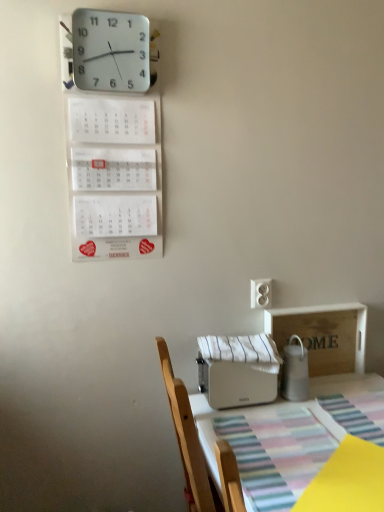
What do you see at coordinates (108, 51) in the screenshot? I see `white plastic wall clock at upper left` at bounding box center [108, 51].

I want to click on white glossy milk jug at right, acting as the 1th appliance starting from the right, so click(295, 371).

The width and height of the screenshot is (384, 512). What do you see at coordinates (290, 437) in the screenshot?
I see `white plastic toaster at lower center` at bounding box center [290, 437].

What is the approximate height of white paper calendar at upper left?

white paper calendar at upper left is 55.90 centimeters tall.

Locate an element on the screen. This screenshot has height=512, width=384. white plastic wall clock at upper left is located at coordinates (108, 51).

Which is more to the left, white plastic electric outlet at center-right or white plastic toaster at lower center?

white plastic electric outlet at center-right.

From a real-world perspective, which is physically above, white plastic electric outlet at center-right or white plastic toaster at lower center?

white plastic electric outlet at center-right, from a real-world perspective.

Are white plastic electric outlet at center-right and white plastic toaster at lower center making contact?

They are not placed beside each other.

In terms of size, does white plastic electric outlet at center-right appear bigger or smaller than white plastic toaster at lower center?

white plastic electric outlet at center-right is smaller than white plastic toaster at lower center.

From the image's perspective, which one is positioned higher, white plastic wall clock at upper left or white plastic toaster at lower center?

white plastic wall clock at upper left.

Does white plastic wall clock at upper left have a lesser width compared to white plastic toaster at lower center?

Correct, the width of white plastic wall clock at upper left is less than that of white plastic toaster at lower center.

Is white plastic wall clock at upper left spatially inside white plastic toaster at lower center, or outside of it?

white plastic wall clock at upper left cannot be found inside white plastic toaster at lower center.

Based on the photo, from a real-world perspective, does white plastic wall clock at upper left sit lower than white plastic toaster at lower center?

No, from a real-world perspective, white plastic wall clock at upper left is not beneath white plastic toaster at lower center.

From a real-world perspective, which object rests below the other?

white plastic toaster at lower center, the second appliance from the right, from a real-world perspective.

Is white plastic toaster at lower center, positioned as the first appliance in left-to-right order, not near white plastic electric outlet at center-right?

No, there isn't a large distance between white plastic toaster at lower center, positioned as the first appliance in left-to-right order, and white plastic electric outlet at center-right.

Can you confirm if white plastic wall clock at upper left is positioned to the right of white striped fabric at center?

No.

Between white plastic wall clock at upper left and white striped fabric at center, which one has less height?

Standing shorter between the two is white striped fabric at center.

From the image's perspective, would you say white plastic wall clock at upper left is positioned over white striped fabric at center?

Yes, from the image's perspective, white plastic wall clock at upper left is above white striped fabric at center.

From the image's perspective, is white glossy milk jug at right, acting as the 1th appliance starting from the right, under white plastic toaster at lower center?

No, from the image's perspective, white glossy milk jug at right, acting as the 1th appliance starting from the right, is not below white plastic toaster at lower center.

Where is `table below the white glossy milk jug at right, acting as the 1th appliance starting from the right (from the image's perspective)`? The height and width of the screenshot is (512, 384). table below the white glossy milk jug at right, acting as the 1th appliance starting from the right (from the image's perspective) is located at coordinates (290, 437).

Does white glossy milk jug at right, acting as the 1th appliance starting from the right, appear on the left side of white plastic toaster at lower center?

Correct, you'll find white glossy milk jug at right, acting as the 1th appliance starting from the right, to the left of white plastic toaster at lower center.

From a real-world perspective, which object stands above the other?

white glossy milk jug at right, acting as the 1th appliance starting from the right.

Find the location of `appliance that is the 2nd object located below the white paper calendar at upper left (from the image's perspective)`. appliance that is the 2nd object located below the white paper calendar at upper left (from the image's perspective) is located at coordinates (236, 382).

From the image's perspective, is white paper calendar at upper left positioned above or below white plastic toaster at lower center, positioned as the first appliance in left-to-right order?

white paper calendar at upper left is above white plastic toaster at lower center, positioned as the first appliance in left-to-right order.

Based on the photo, do you think white paper calendar at upper left is within white plastic toaster at lower center, positioned as the first appliance in left-to-right order, or outside of it?

white paper calendar at upper left is not enclosed by white plastic toaster at lower center, positioned as the first appliance in left-to-right order.

Is white plastic toaster at lower center wider or thinner than white plastic wall clock at upper left?

Considering their sizes, white plastic toaster at lower center looks broader than white plastic wall clock at upper left.

Which of these two, white plastic toaster at lower center or white plastic wall clock at upper left, stands shorter?

Standing shorter between the two is white plastic wall clock at upper left.

Find the location of `table located below the white plastic wall clock at upper left (from the image's perspective)`. table located below the white plastic wall clock at upper left (from the image's perspective) is located at coordinates point(290,437).

Locate an element on the screen. This screenshot has height=512, width=384. table below the white plastic electric outlet at center-right (from a real-world perspective) is located at coordinates (290, 437).

The height and width of the screenshot is (512, 384). What are the coordinates of `wall clock that is above the white plastic toaster at lower center (from a real-world perspective)` in the screenshot? It's located at (108, 51).

Considering their positions, is white glossy milk jug at right, acting as the 1th appliance starting from the right, positioned closer to white plastic wall clock at upper left than white plastic electric outlet at center-right?

Among the two, white plastic electric outlet at center-right is located nearer to white plastic wall clock at upper left.

Which object lies nearer to the anchor point white glossy milk jug at right, acting as the 1th appliance starting from the right, white paper calendar at upper left or white striped fabric at center?

Based on the image, white striped fabric at center appears to be nearer to white glossy milk jug at right, acting as the 1th appliance starting from the right.

From the image, which object appears to be nearer to white plastic electric outlet at center-right, white plastic wall clock at upper left or white glossy milk jug at right, placed as the 2th appliance when sorted from left to right?

Based on the image, white glossy milk jug at right, placed as the 2th appliance when sorted from left to right, appears to be nearer to white plastic electric outlet at center-right.

Based on the photo, based on their spatial positions, is white paper calendar at upper left or white striped fabric at center closer to white plastic toaster at lower center, positioned as the first appliance in left-to-right order?

white striped fabric at center is closer to white plastic toaster at lower center, positioned as the first appliance in left-to-right order.

Based on their spatial positions, is white plastic toaster at lower center or white plastic wall clock at upper left further from white paper calendar at upper left?

Among the two, white plastic toaster at lower center is located further to white paper calendar at upper left.

Estimate the real-world distances between objects in this image. Which object is further from white plastic wall clock at upper left, white plastic toaster at lower center or white striped fabric at center?

white plastic toaster at lower center is further to white plastic wall clock at upper left.

From the image, which object appears to be farther from white paper calendar at upper left, white striped fabric at center or white plastic wall clock at upper left?

The object further to white paper calendar at upper left is white striped fabric at center.

Estimate the real-world distances between objects in this image. Which object is further from white paper calendar at upper left, white plastic toaster at lower center or white plastic electric outlet at center-right?

white plastic toaster at lower center is further to white paper calendar at upper left.

Find the location of `blanket between white plastic electric outlet at center-right and white plastic toaster at lower center, the second appliance from the right, from top to bottom`. blanket between white plastic electric outlet at center-right and white plastic toaster at lower center, the second appliance from the right, from top to bottom is located at coordinates (242, 350).

The width and height of the screenshot is (384, 512). What are the coordinates of `blanket between white plastic electric outlet at center-right and white plastic toaster at lower center in the up-down direction` in the screenshot? It's located at point(242,350).

Where is `bulletin board between white plastic wall clock at upper left and white plastic toaster at lower center vertically`? Image resolution: width=384 pixels, height=512 pixels. bulletin board between white plastic wall clock at upper left and white plastic toaster at lower center vertically is located at coordinates (114, 176).

Image resolution: width=384 pixels, height=512 pixels. I want to click on appliance positioned between white plastic toaster at lower center and white glossy milk jug at right, placed as the 2th appliance when sorted from left to right, from near to far, so click(236, 382).